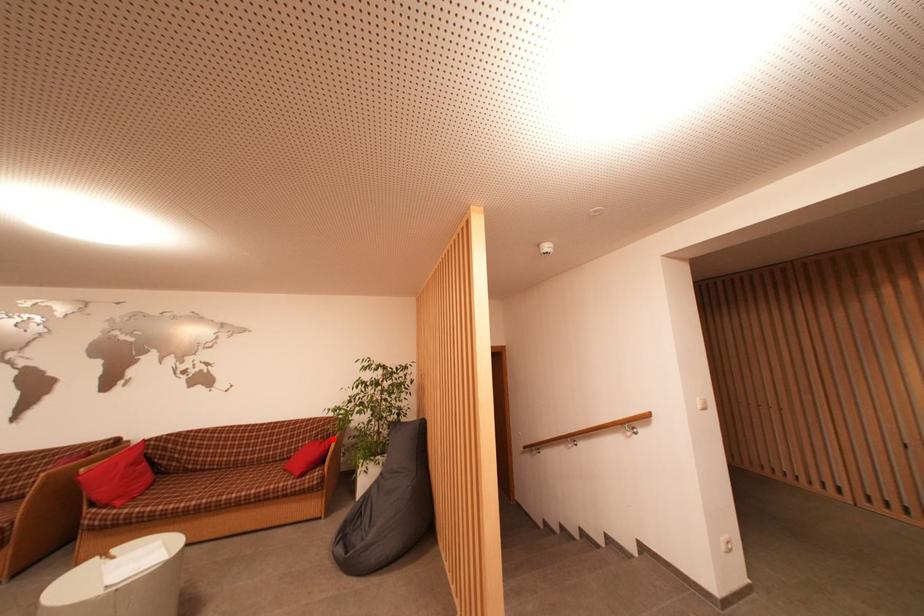
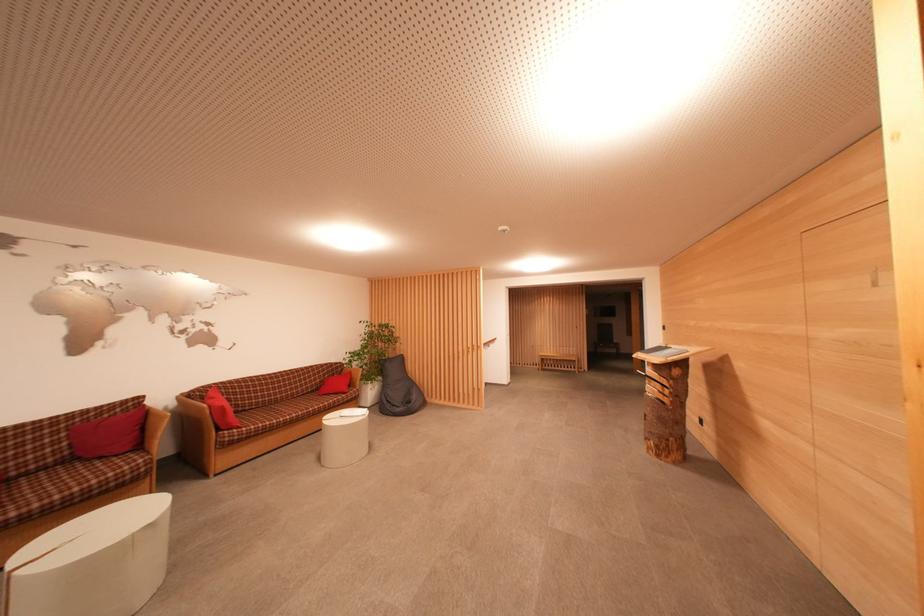
Question: A red point is marked in image1. In image2, is the corresponding 3D point closer to the camera or farther? Reply with the corresponding letter.

Choices:
 (A) The corresponding 3D point is closer.
 (B) The corresponding 3D point is farther.

Answer: (A)